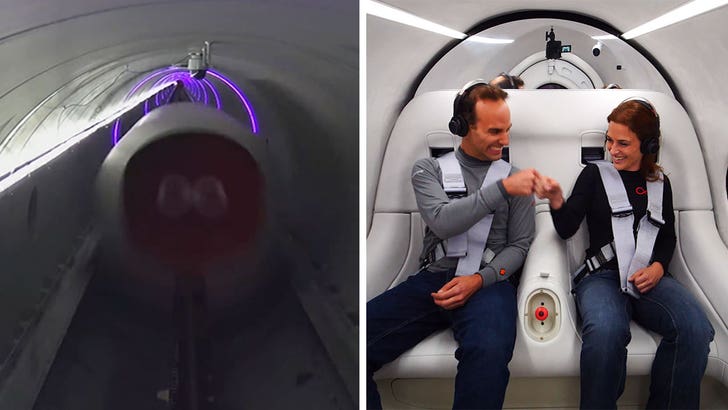
Identify the location of seat. (561, 374).